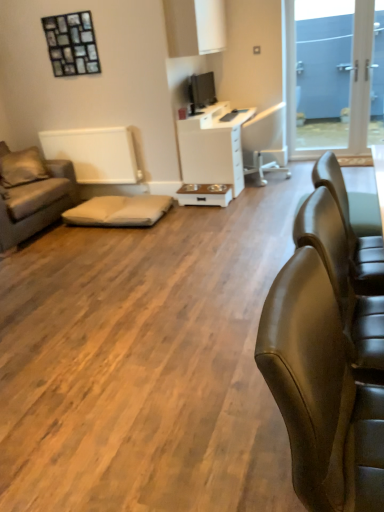
Question: Is beige fabric cushion at center inside the boundaries of white plastic chair at center, or outside?

Choices:
 (A) outside
 (B) inside

Answer: (A)

Question: From a real-world perspective, is beige fabric cushion at center physically located above or below white plastic chair at center?

Choices:
 (A) above
 (B) below

Answer: (B)

Question: Which object is positioned farthest from the leather couch at right, acting as the 1th chair starting from the front?

Choices:
 (A) beige fabric pillow at left
 (B) white glossy table at center
 (C) matte black tv at upper center
 (D) white plastic chair at center
 (E) leather couch at right, the second chair when ordered from bottom to top

Answer: (C)

Question: Estimate the real-world distances between objects in this image. Which object is farther from the leather couch at right, the first chair positioned from the right?

Choices:
 (A) beige fabric cushion at center
 (B) brown fabric couch at left
 (C) leather couch at right, which is the 1th chair from bottom to top
 (D) beige fabric pillow at left
 (E) matte black tv at upper center

Answer: (D)